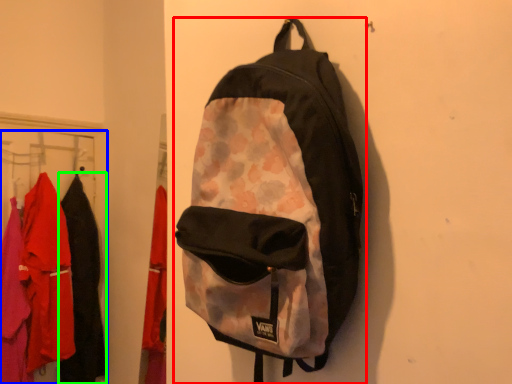
Question: Based on their relative distances, which object is farther from backpack (highlighted by a red box)? Choose from closet (highlighted by a blue box) and clothing (highlighted by a green box).

Choices:
 (A) closet
 (B) clothing

Answer: (B)